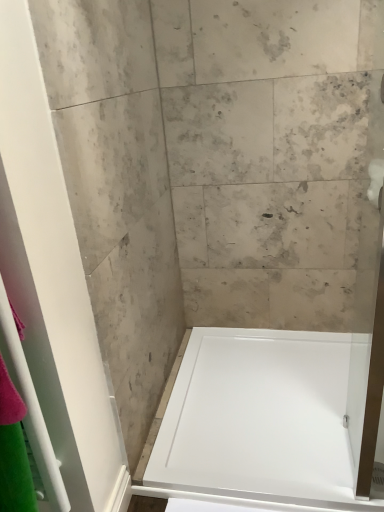
Image resolution: width=384 pixels, height=512 pixels. What do you see at coordinates (265, 420) in the screenshot?
I see `white glossy bathtub at center` at bounding box center [265, 420].

Locate an element on the screen. The image size is (384, 512). white glossy shower door at left is located at coordinates (53, 280).

Does point (354, 366) come farther from viewer compared to point (67, 426)?

Yes, it is.

Identify the location of bathtub that is on the right side of white glossy shower door at left. (265, 420).

Is white glossy bathtub at center taller or shorter than white glossy shower door at left?

Clearly, white glossy bathtub at center is shorter compared to white glossy shower door at left.

Visually, is white glossy bathtub at center positioned to the left or to the right of white glossy shower door at left?

Based on their positions, white glossy bathtub at center is located to the right of white glossy shower door at left.

Is white glossy shower door at left situated inside white matte toilet paper at upper right or outside?

white glossy shower door at left is not inside white matte toilet paper at upper right, it's outside.

Where is `screen door below the white matte toilet paper at upper right (from a real-world perspective)`? This screenshot has height=512, width=384. screen door below the white matte toilet paper at upper right (from a real-world perspective) is located at coordinates (53, 280).

Is white matte toilet paper at upper right at the back of white glossy shower door at left?

That's right, white glossy shower door at left is facing away from white matte toilet paper at upper right.

From the image's perspective, which is above, white glossy shower door at left or white matte toilet paper at upper right?

white matte toilet paper at upper right is shown above in the image.

From a real-world perspective, which is physically below, white glossy shower door at left or white glossy bathtub at center?

white glossy bathtub at center.

Considering the sizes of objects white glossy shower door at left and white glossy bathtub at center in the image provided, who is taller, white glossy shower door at left or white glossy bathtub at center?

white glossy shower door at left is taller.

Would you say white glossy shower door at left is to the left or to the right of white glossy bathtub at center in the picture?

white glossy shower door at left is to the left of white glossy bathtub at center.

Is white glossy shower door at left positioned far away from white glossy bathtub at center?

No.

In terms of height, does white glossy bathtub at center look taller or shorter compared to white matte toilet paper at upper right?

Considering their sizes, white glossy bathtub at center has less height than white matte toilet paper at upper right.

Considering the relative positions of white glossy bathtub at center and white matte toilet paper at upper right in the image provided, is white glossy bathtub at center to the left or to the right of white matte toilet paper at upper right?

white glossy bathtub at center is to the left of white matte toilet paper at upper right.

Relative to white matte toilet paper at upper right, is white glossy bathtub at center in front or behind?

white glossy bathtub at center is positioned farther from the viewer than white matte toilet paper at upper right.

Based on the photo, is white matte toilet paper at upper right positioned with its back to white glossy bathtub at center?

No, white matte toilet paper at upper right is not facing away from white glossy bathtub at center.

Which object is positioned more to the right, white matte toilet paper at upper right or white glossy bathtub at center?

From the viewer's perspective, white matte toilet paper at upper right appears more on the right side.

Is white matte toilet paper at upper right not within white glossy bathtub at center?

Yes.

Can you confirm if white matte toilet paper at upper right is smaller than white glossy bathtub at center?

Correct, white matte toilet paper at upper right occupies less space than white glossy bathtub at center.

Is white matte toilet paper at upper right touching white glossy shower door at left?

white matte toilet paper at upper right is not next to white glossy shower door at left, and they're not touching.

From the image's perspective, which one is positioned higher, white matte toilet paper at upper right or white glossy shower door at left?

white matte toilet paper at upper right is shown above in the image.

Identify the location of screen door located underneath the white matte toilet paper at upper right (from a real-world perspective). The image size is (384, 512). (53, 280).

Which of these two, white matte toilet paper at upper right or white glossy shower door at left, stands shorter?

Standing shorter between the two is white matte toilet paper at upper right.

In order to click on bathtub beneath the white glossy shower door at left (from a real-world perspective) in this screenshot , I will do `click(265, 420)`.

Where is `screen door that is below the white matte toilet paper at upper right (from the image's perspective)`? The height and width of the screenshot is (512, 384). screen door that is below the white matte toilet paper at upper right (from the image's perspective) is located at coordinates (53, 280).

Considering their positions, is white glossy bathtub at center positioned closer to white glossy shower door at left than white matte toilet paper at upper right?

white glossy bathtub at center lies closer to white glossy shower door at left than the other object.

Based on their spatial positions, is white glossy shower door at left or white matte toilet paper at upper right further from white glossy bathtub at center?

white matte toilet paper at upper right.

In the scene shown: When comparing their distances from white matte toilet paper at upper right, does white glossy bathtub at center or white glossy shower door at left seem closer?

Based on the image, white glossy bathtub at center appears to be nearer to white matte toilet paper at upper right.

When comparing their distances from white matte toilet paper at upper right, does white glossy shower door at left or white glossy bathtub at center seem closer?

Based on the image, white glossy bathtub at center appears to be nearer to white matte toilet paper at upper right.

When comparing their distances from white glossy bathtub at center, does white matte toilet paper at upper right or white glossy shower door at left seem further?

white matte toilet paper at upper right lies further to white glossy bathtub at center than the other object.

Estimate the real-world distances between objects in this image. Which object is further from white glossy shower door at left, white matte toilet paper at upper right or white glossy bathtub at center?

The object further to white glossy shower door at left is white matte toilet paper at upper right.

This screenshot has width=384, height=512. In order to click on screen door between white matte toilet paper at upper right and white glossy bathtub at center in the vertical direction in this screenshot , I will do `click(53, 280)`.